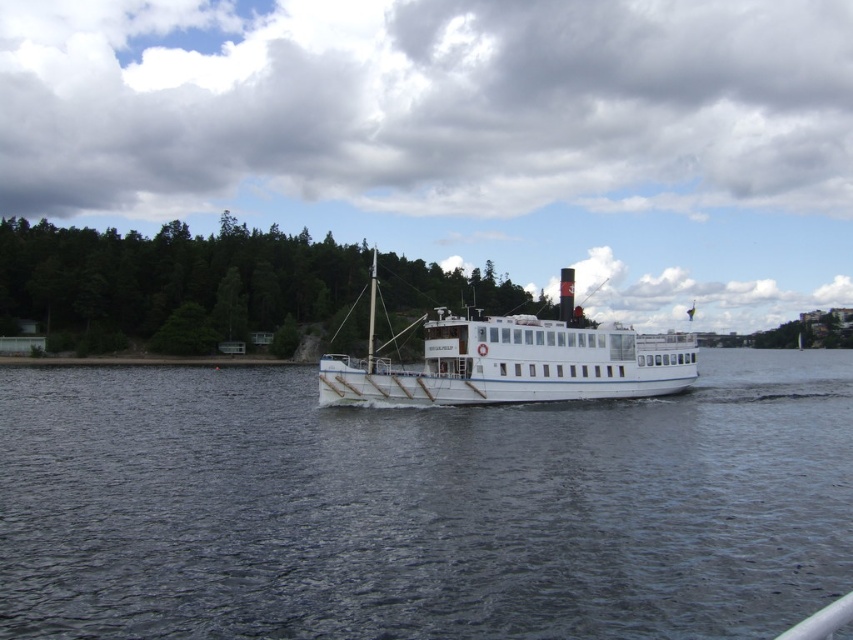
Question: Does green leafy trees at left come behind white matte boat at center?

Choices:
 (A) yes
 (B) no

Answer: (A)

Question: Which object is farther from the camera taking this photo?

Choices:
 (A) white matte boat at center
 (B) green leafy trees at left
 (C) dark blue water at center

Answer: (B)

Question: Which of the following is the closest to the observer?

Choices:
 (A) (99, 330)
 (B) (368, 604)
 (C) (590, 358)

Answer: (B)

Question: Is dark blue water at center smaller than white matte boat at center?

Choices:
 (A) no
 (B) yes

Answer: (B)

Question: Can you confirm if green leafy trees at left is positioned above white matte boat at center?

Choices:
 (A) yes
 (B) no

Answer: (A)

Question: Which point is farther to the camera?

Choices:
 (A) green leafy trees at left
 (B) white matte boat at center

Answer: (A)